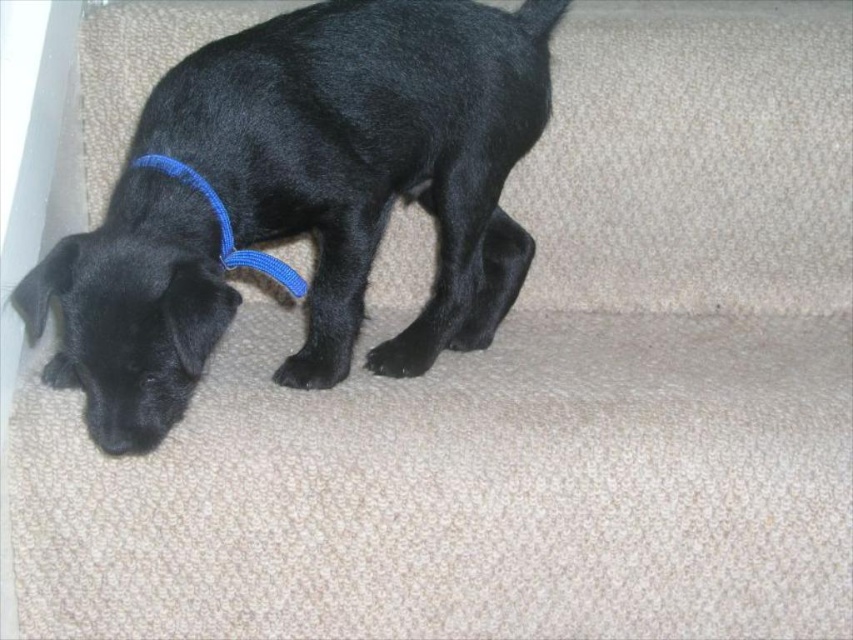
Question: Which of the following is the closest to the observer?

Choices:
 (A) black fur dog at lower left
 (B) blue fabric neckband at left

Answer: (A)

Question: Does black fur dog at lower left appear on the left side of blue fabric neckband at left?

Choices:
 (A) no
 (B) yes

Answer: (A)

Question: Which of the following is the closest to the observer?

Choices:
 (A) blue fabric neckband at left
 (B) black fur dog at lower left

Answer: (B)

Question: Is black fur dog at lower left closer to the viewer compared to blue fabric neckband at left?

Choices:
 (A) no
 (B) yes

Answer: (B)

Question: From the image, what is the correct spatial relationship of black fur dog at lower left in relation to blue fabric neckband at left?

Choices:
 (A) left
 (B) right

Answer: (B)